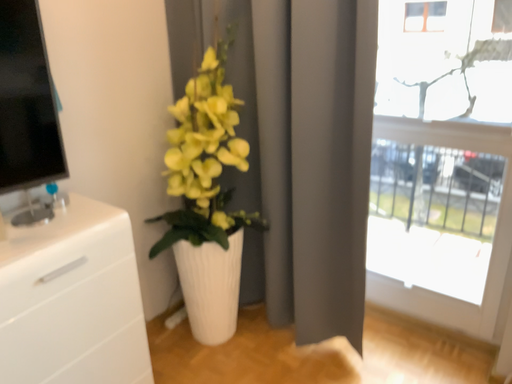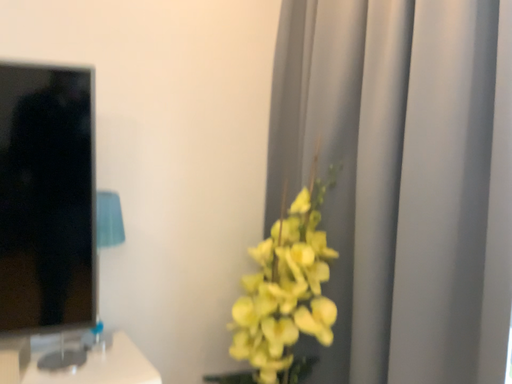
Question: Which way did the camera rotate in the video?

Choices:
 (A) rotated left
 (B) rotated right

Answer: (A)